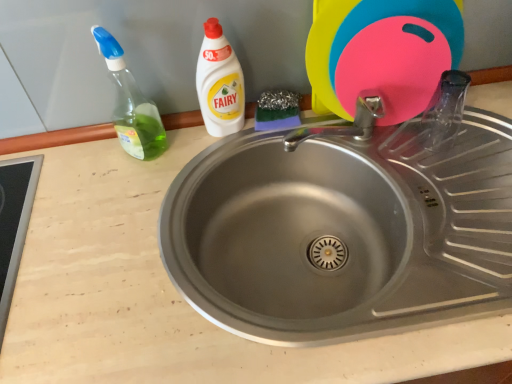
Where is `empty space that is ontop of stainless steel sink at center`? This screenshot has width=512, height=384. empty space that is ontop of stainless steel sink at center is located at coordinates (430, 184).